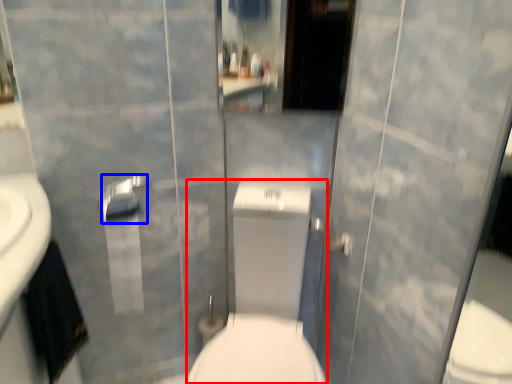
Question: Which of the following is the farthest to the observer, sit (highlighted by a red box) or towel bar (highlighted by a blue box)?

Choices:
 (A) sit
 (B) towel bar

Answer: (B)